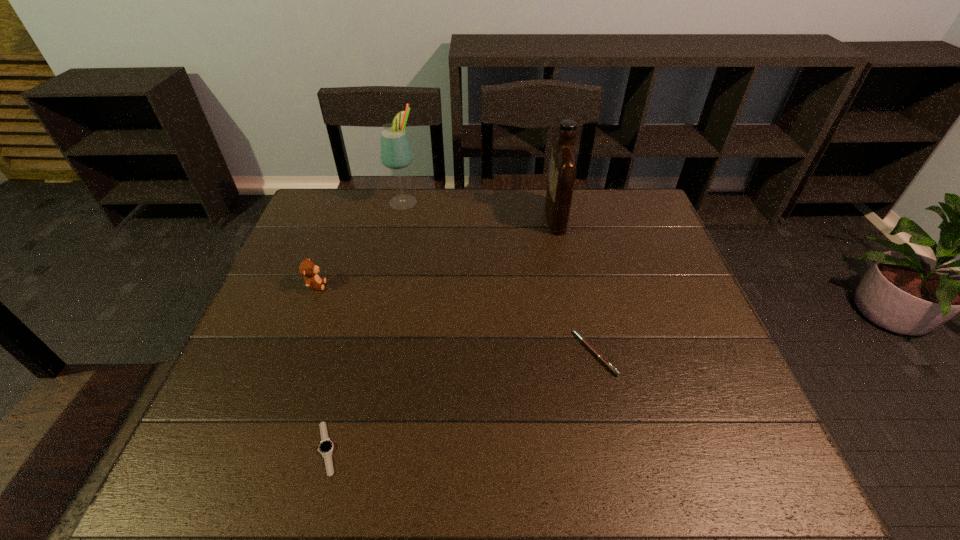
The image size is (960, 540). In order to click on alcohol in this screenshot , I will do `click(395, 151)`.

This screenshot has height=540, width=960. I want to click on liquor, so click(563, 166).

Identify the location of teddy bear. The height and width of the screenshot is (540, 960). (308, 269).

What are the coordinates of `the third tallest object` in the screenshot? It's located at (308, 269).

Where is `the fourth farthest object`? the fourth farthest object is located at coordinates (601, 357).

The width and height of the screenshot is (960, 540). What are the coordinates of `the second shortest object` in the screenshot? It's located at (601, 357).

Locate an element on the screen. The height and width of the screenshot is (540, 960). watch is located at coordinates (326, 446).

The width and height of the screenshot is (960, 540). In order to click on the nearest object in this screenshot , I will do `click(326, 446)`.

You are a GUI agent. You are given a task and a screenshot of the screen. Output one action in this format:
    pyautogui.click(x=<x>, y=<y>)
    Task: Click on the vacant space located on the right of the alcohol
    This screenshot has width=960, height=540.
    Given the screenshot: What is the action you would take?
    pyautogui.click(x=522, y=201)

The height and width of the screenshot is (540, 960). Identify the location of vacant space located 0.260m on the label side of the liquor. (466, 217).